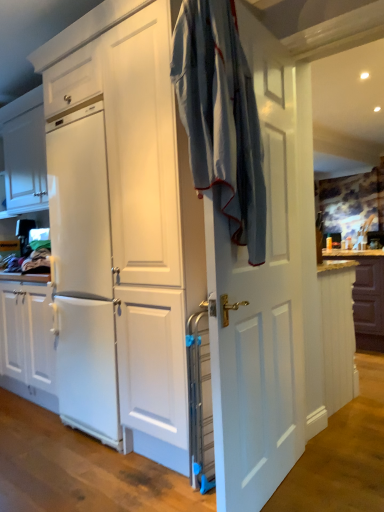
Locate an element on the screen. This screenshot has width=384, height=512. vacant region under white matte door at center (from a real-world perspective) is located at coordinates point(283,484).